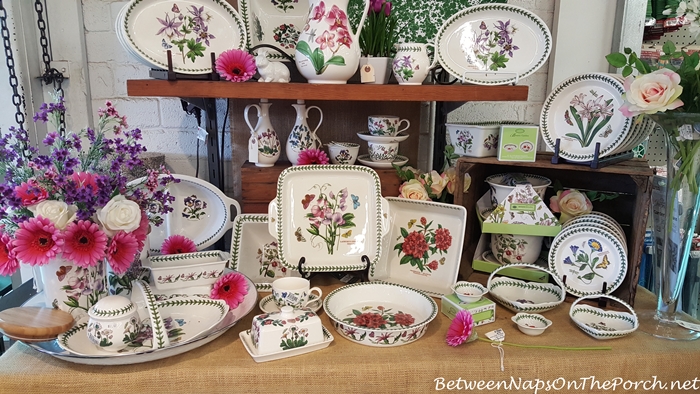
Where is `white brick wall`? Image resolution: width=700 pixels, height=394 pixels. white brick wall is located at coordinates (99, 67), (533, 84), (587, 31).